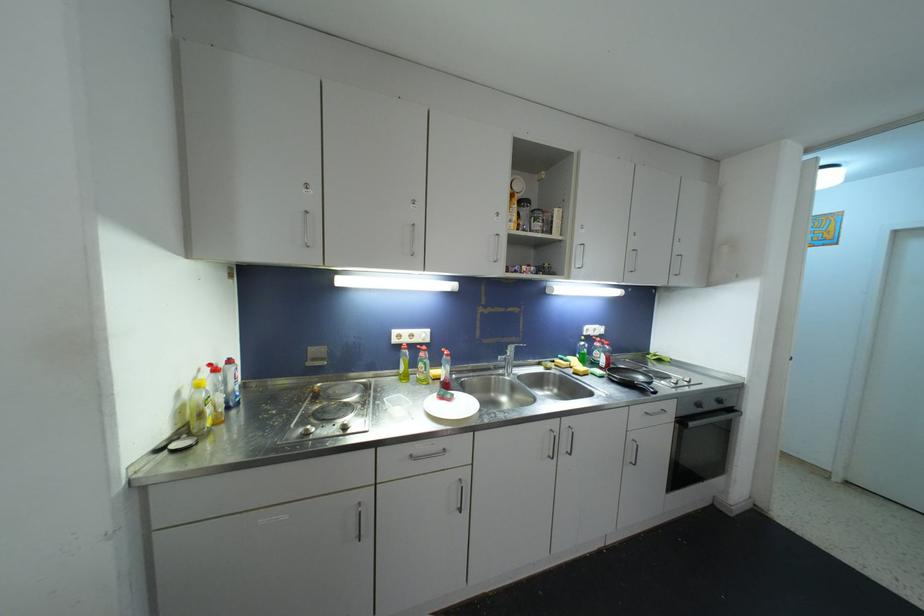
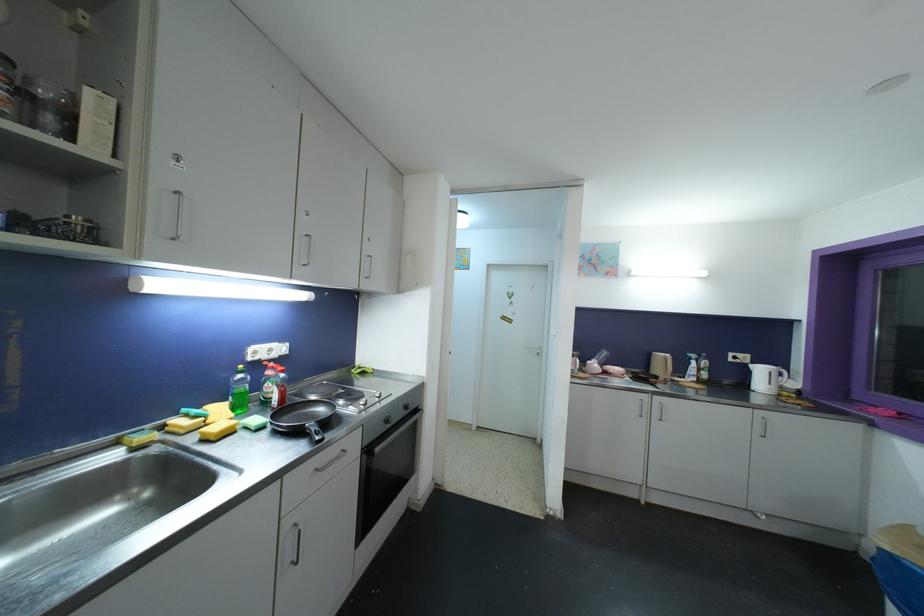
In the second image, find the point that corresponds to (x=677, y=257) in the first image.

(369, 257)